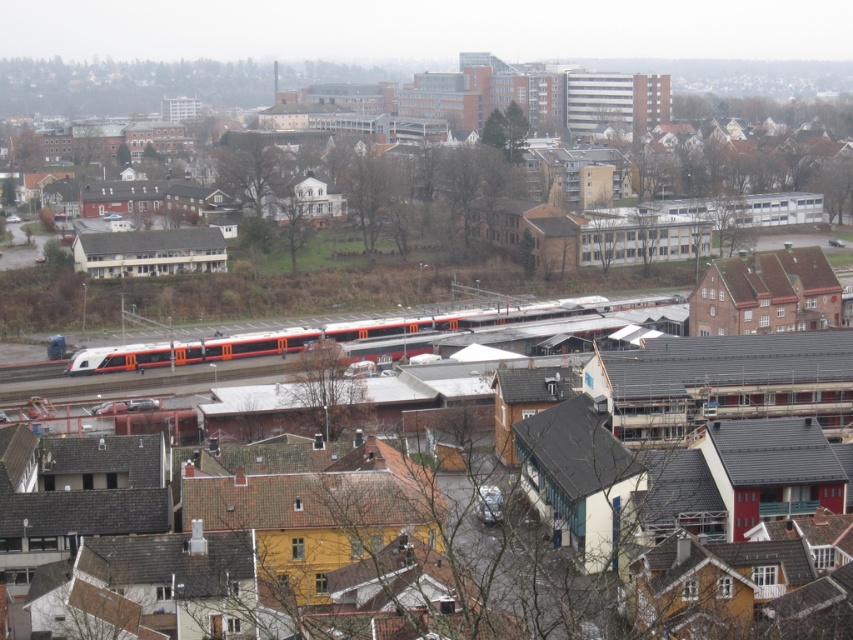
Question: Which object appears closest to the camera in this image?

Choices:
 (A) matte orange train at center
 (B) orange metallic train at center

Answer: (B)

Question: Among these points, which one is nearest to the camera?

Choices:
 (A) (15, 90)
 (B) (480, 310)

Answer: (B)

Question: Does matte orange train at center appear on the left side of orange metallic train at center?

Choices:
 (A) yes
 (B) no

Answer: (B)

Question: Is the position of matte orange train at center less distant than that of orange metallic train at center?

Choices:
 (A) no
 (B) yes

Answer: (A)

Question: Can you confirm if matte orange train at center is smaller than orange metallic train at center?

Choices:
 (A) no
 (B) yes

Answer: (A)